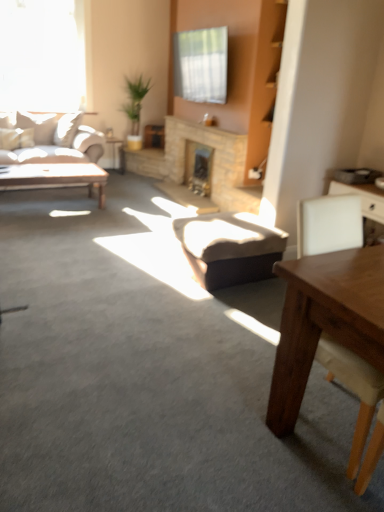
Question: Does point (226, 220) appear closer or farther from the camera than point (1, 20)?

Choices:
 (A) farther
 (B) closer

Answer: (B)

Question: Is dark brown leather stool at center to the left or to the right of transparent glass window at upper left in the image?

Choices:
 (A) left
 (B) right

Answer: (B)

Question: Considering the real-world distances, which object is farthest from the wooden table at lower right?

Choices:
 (A) matte black side table at left
 (B) brick fireplace at center, which is the 1th fireplace from back to front
 (C) dark brown leather stool at center
 (D) transparent glass window at upper left
 (E) matte wooden coffee table at left

Answer: (D)

Question: Which object is the closest to the natural stone fireplace at center, the second fireplace when ordered from back to front?

Choices:
 (A) matte black side table at left
 (B) dark brown leather stool at center
 (C) brick fireplace at center, which is the 1th fireplace from back to front
 (D) matte wooden coffee table at left
 (E) wooden table at lower right

Answer: (C)